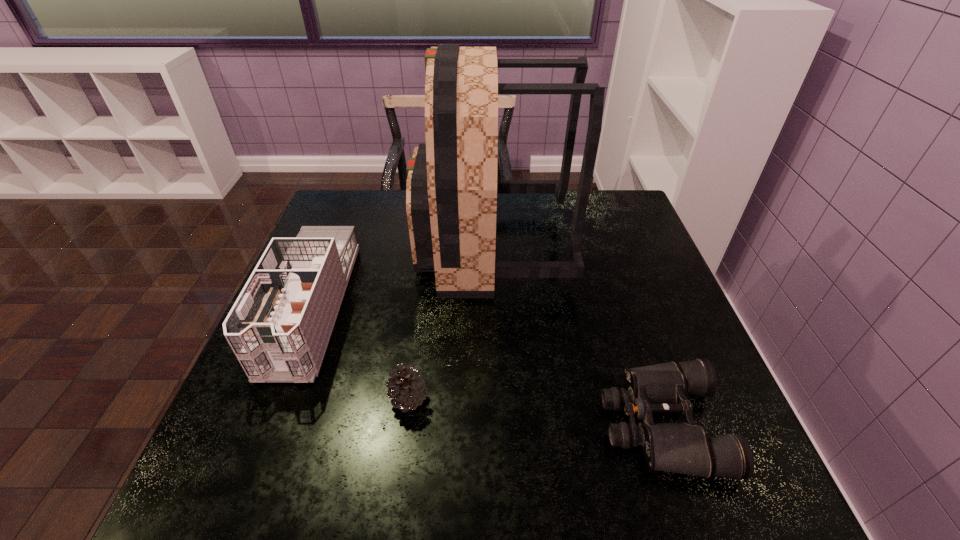
Image resolution: width=960 pixels, height=540 pixels. In order to click on free space at the right edge of the desktop in this screenshot , I will do `click(674, 325)`.

Where is `free space at the far left corner of the desktop`? This screenshot has height=540, width=960. free space at the far left corner of the desktop is located at coordinates (354, 213).

The image size is (960, 540). Identify the location of free space at the far right corner. (616, 213).

Find the location of a particular element. The image size is (960, 540). vacant point located between the shortest object and the tallest object is located at coordinates (577, 335).

Locate an element on the screen. Image resolution: width=960 pixels, height=540 pixels. vacant area between the shortest object and the pinecone is located at coordinates (535, 412).

This screenshot has height=540, width=960. What are the coordinates of `empty location between the backpack and the binoculars` in the screenshot? It's located at (577, 335).

Where is `empty location between the pinecone and the leftmost object`? empty location between the pinecone and the leftmost object is located at coordinates (360, 353).

Identify the location of vacant area that lies between the leftmost object and the shortest object. This screenshot has height=540, width=960. 487,366.

This screenshot has width=960, height=540. Identify the location of empty space that is in between the dollhouse and the tallest object. [x=401, y=276].

Locate an element on the screen. The width and height of the screenshot is (960, 540). free space between the binoculars and the third shortest object is located at coordinates (487, 366).